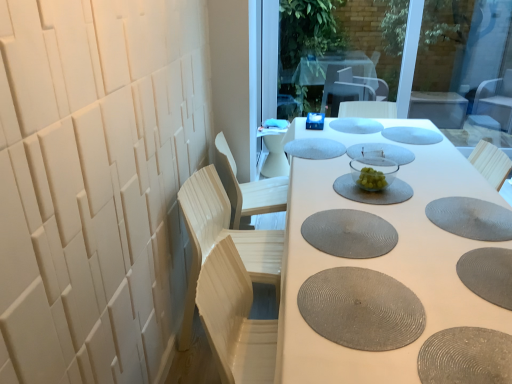
Locate an element on the screen. empty space that is in between gray textured placemat at lower right, placed as the third manhole cover when sorted from front to back, and gray textured placemat at lower right, the 6th manhole cover in the back-to-front sequence is located at coordinates (467, 244).